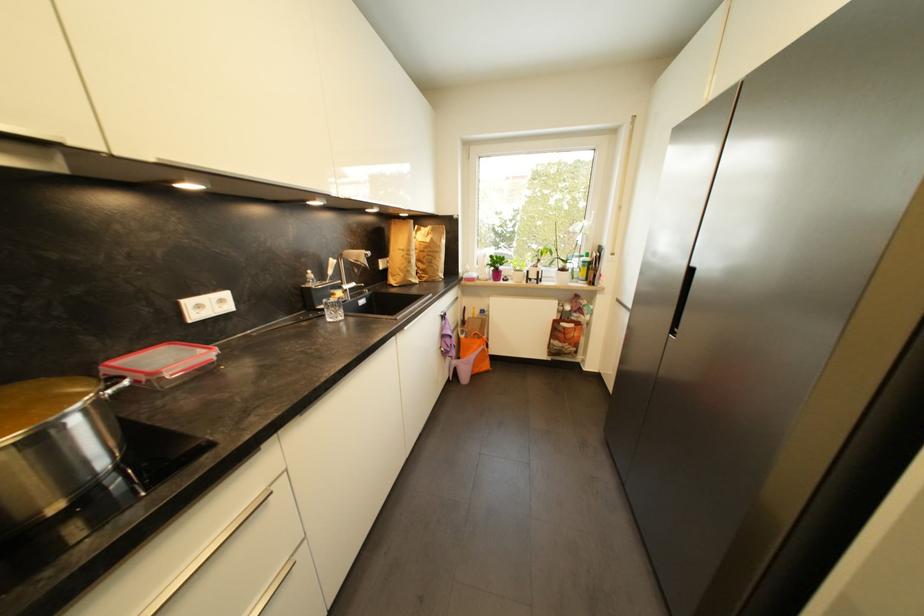
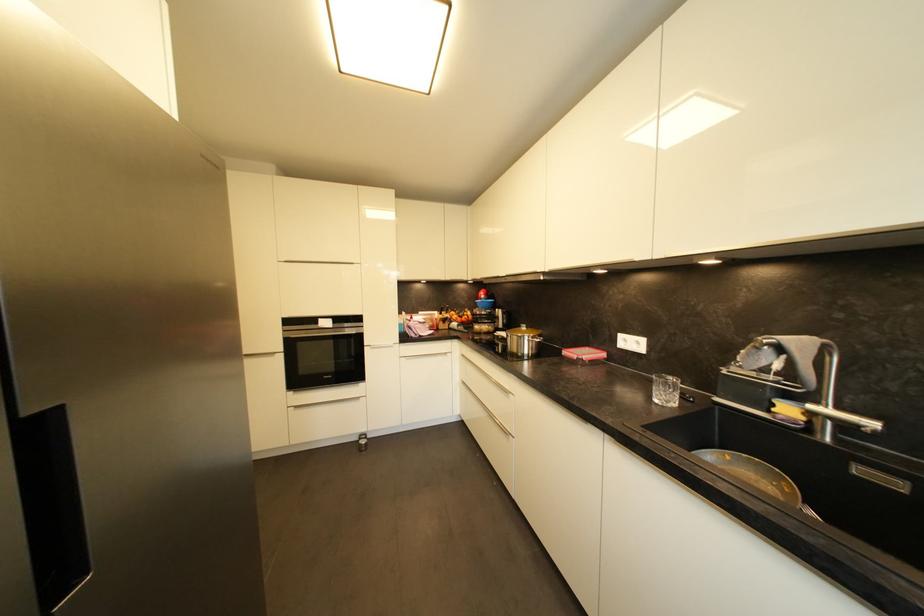
Where in the second image is the point corresponding to the point at 368,304 from the first image?

(904, 487)